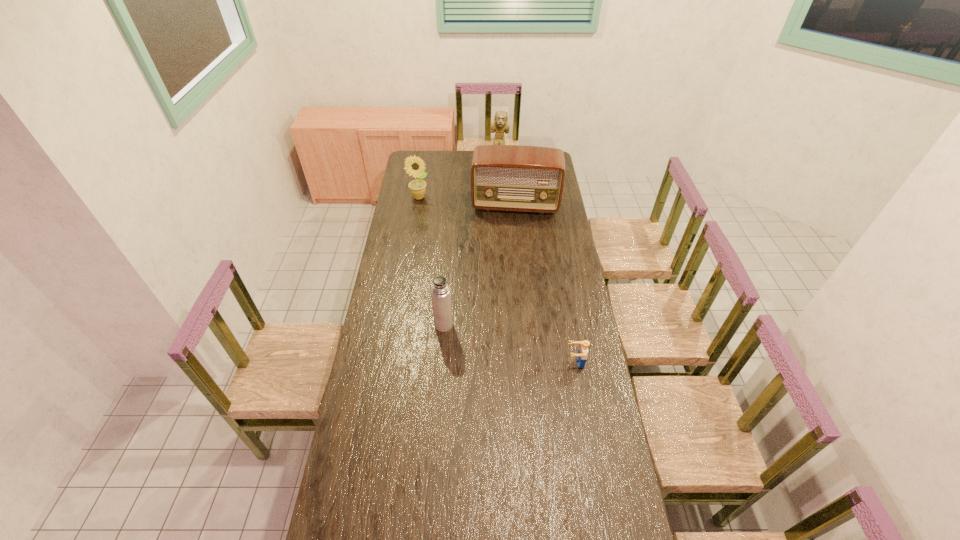
Locate which object ranks third in proximity to the leftmost object. Please provide its 2D coordinates. Your answer should be formatted as a tuple, i.e. [(x, y)], where the tuple contains the x and y coordinates of a point satisfying the conditions above.

[(440, 291)]

Where is `free point that satisfies the following two spatial constraints: 1. on the back side of the farthest object; 2. on the left side of the second object from left to right`? Image resolution: width=960 pixels, height=540 pixels. free point that satisfies the following two spatial constraints: 1. on the back side of the farthest object; 2. on the left side of the second object from left to right is located at coordinates (455, 163).

Find the location of a particular element. The height and width of the screenshot is (540, 960). free space that satisfies the following two spatial constraints: 1. on the front side of the farthest object; 2. on the face of the shortest object is located at coordinates (509, 362).

Locate an element on the screen. The image size is (960, 540). free space in the image that satisfies the following two spatial constraints: 1. on the back side of the thermos bottle; 2. on the right side of the radio receiver is located at coordinates (452, 205).

This screenshot has width=960, height=540. In order to click on free space that satisfies the following two spatial constraints: 1. on the front side of the radio receiver; 2. on the left side of the farthest object in this screenshot , I will do `click(500, 205)`.

Where is `free spot that satisfies the following two spatial constraints: 1. on the front side of the nearest object; 2. on the face of the farthest object`? free spot that satisfies the following two spatial constraints: 1. on the front side of the nearest object; 2. on the face of the farthest object is located at coordinates (509, 362).

Where is `free space that satisfies the following two spatial constraints: 1. on the front side of the sunflower; 2. on the face of the shortest object`? free space that satisfies the following two spatial constraints: 1. on the front side of the sunflower; 2. on the face of the shortest object is located at coordinates (392, 362).

Locate an element on the screen. The image size is (960, 540). free location that satisfies the following two spatial constraints: 1. on the back side of the leftmost object; 2. on the left side of the farthest object is located at coordinates coord(424,163).